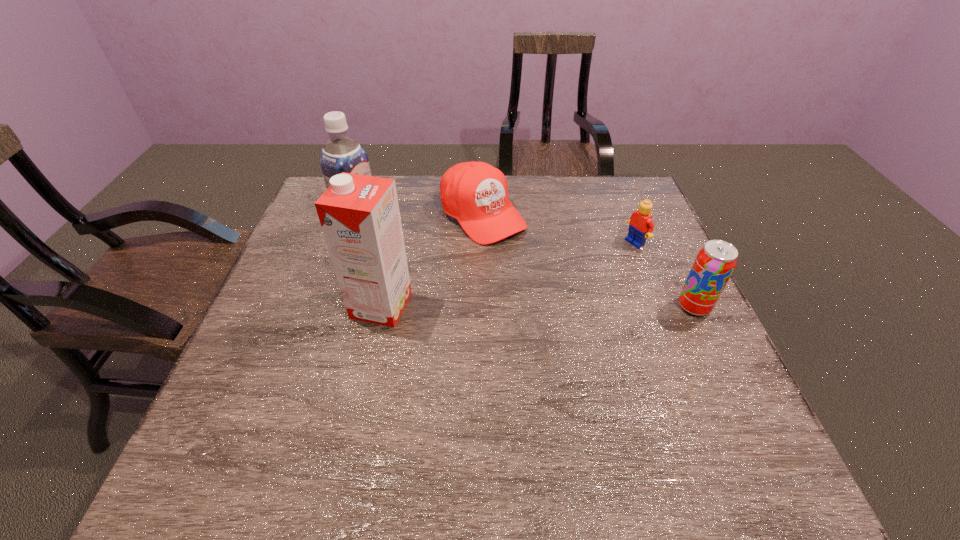
What are the coordinates of `vacant area between the soda can and the third object from right to left` in the screenshot? It's located at (588, 261).

Find the location of a particular element. Image resolution: width=960 pixels, height=540 pixels. empty space between the rightmost object and the carton is located at coordinates (538, 306).

At what (x,y) coordinates should I click in order to perform the action: click on vacant area that lies between the baseball cap and the carton. Please return your answer as a coordinate pair (x, y). The width and height of the screenshot is (960, 540). Looking at the image, I should click on (432, 260).

Locate an element on the screen. free spot between the second object from right to left and the third object from right to left is located at coordinates (559, 229).

At what (x,y) coordinates should I click in order to perform the action: click on free space that is in between the third tallest object and the carton. Please return your answer as a coordinate pair (x, y). The image size is (960, 540). Looking at the image, I should click on (538, 306).

Where is `free space that is in between the carton and the soda can`? Image resolution: width=960 pixels, height=540 pixels. free space that is in between the carton and the soda can is located at coordinates (538, 306).

I want to click on empty location between the soda can and the baseball cap, so click(x=588, y=261).

I want to click on object that ranks as the fourth closest to the Lego, so click(340, 154).

What are the coordinates of `object that is the fourth closest to the carton` in the screenshot? It's located at (715, 262).

You are a GUI agent. You are given a task and a screenshot of the screen. Output one action in this format:
    pyautogui.click(x=<x>, y=<y>)
    Task: Click on the vacant space that satisfies the following two spatial constraints: 1. on the back side of the carton; 2. on the left side of the third object from left to right
    
    Given the screenshot: What is the action you would take?
    pyautogui.click(x=401, y=215)